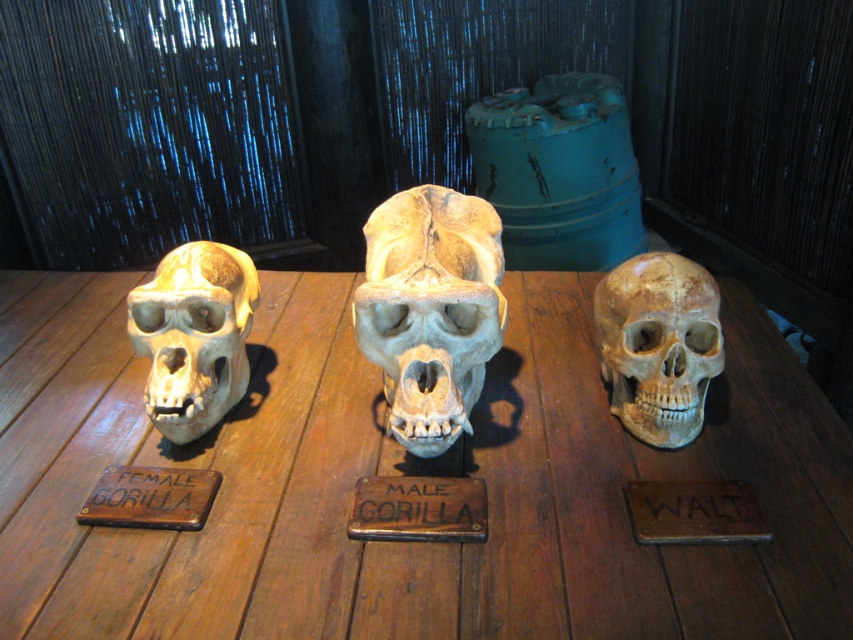
Question: Can you confirm if wooden table at center is bigger than matte beige skull at center?

Choices:
 (A) no
 (B) yes

Answer: (B)

Question: Which of the following is the closest to the observer?

Choices:
 (A) matte beige skull at left
 (B) matte bone skull at center
 (C) brown wood sign at center
 (D) wooden sign at center

Answer: (C)

Question: Among these points, which one is farthest from the camera?

Choices:
 (A) (140, 492)
 (B) (706, 355)

Answer: (B)

Question: Can you confirm if wooden table at center is thinner than matte bone skull at center?

Choices:
 (A) yes
 (B) no

Answer: (B)

Question: Considering the relative positions of wooden table at center and brown wood plaque at lower left in the image provided, where is wooden table at center located with respect to brown wood plaque at lower left?

Choices:
 (A) left
 (B) right

Answer: (B)

Question: Which point is farther from the camera taking this photo?

Choices:
 (A) (128, 474)
 (B) (355, 490)
 (C) (225, 352)

Answer: (C)